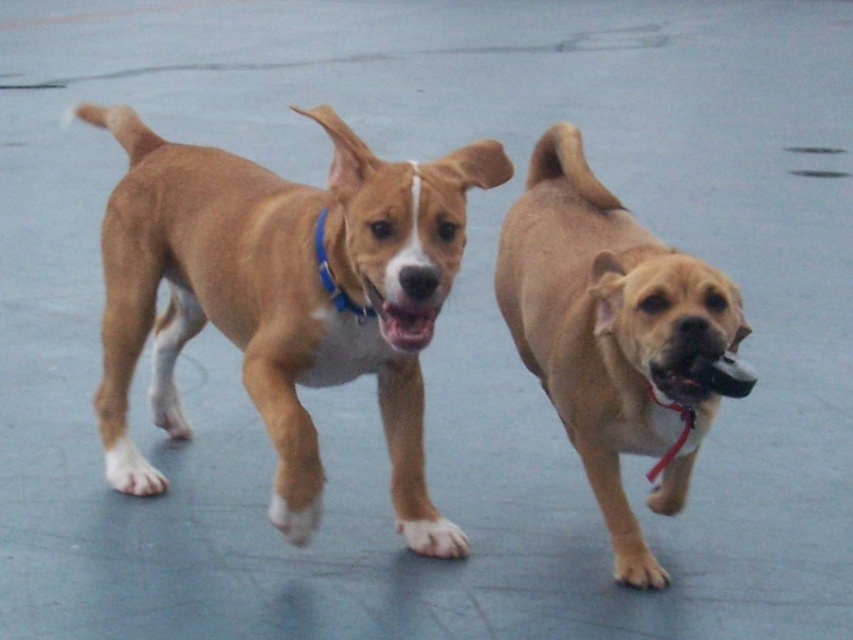
Where is `brown matte dog at center`? The width and height of the screenshot is (853, 640). brown matte dog at center is located at coordinates (280, 296).

Between point (316, 308) and point (711, 412), which one is positioned in front?

Point (316, 308) is more forward.

The height and width of the screenshot is (640, 853). What are the coordinates of `brown matte dog at center` in the screenshot? It's located at (280, 296).

Between light brown fur at center and blue fabric neckband at center, which one is positioned lower?

light brown fur at center is below.

Which is above, light brown fur at center or blue fabric neckband at center?

blue fabric neckband at center is above.

Is point (677, 460) closer to viewer compared to point (352, 314)?

No, it is behind (352, 314).

This screenshot has width=853, height=640. Find the location of `light brown fur at center`. light brown fur at center is located at coordinates (611, 333).

Is pink glossy mouth at center to the right of blue fabric neckband at center from the viewer's perspective?

Correct, you'll find pink glossy mouth at center to the right of blue fabric neckband at center.

Is pink glossy mouth at center wider than blue fabric neckband at center?

In fact, pink glossy mouth at center might be narrower than blue fabric neckband at center.

Is point (427, 317) in front of point (318, 268)?

That is True.

Find the location of a particular element. pink glossy mouth at center is located at coordinates (405, 324).